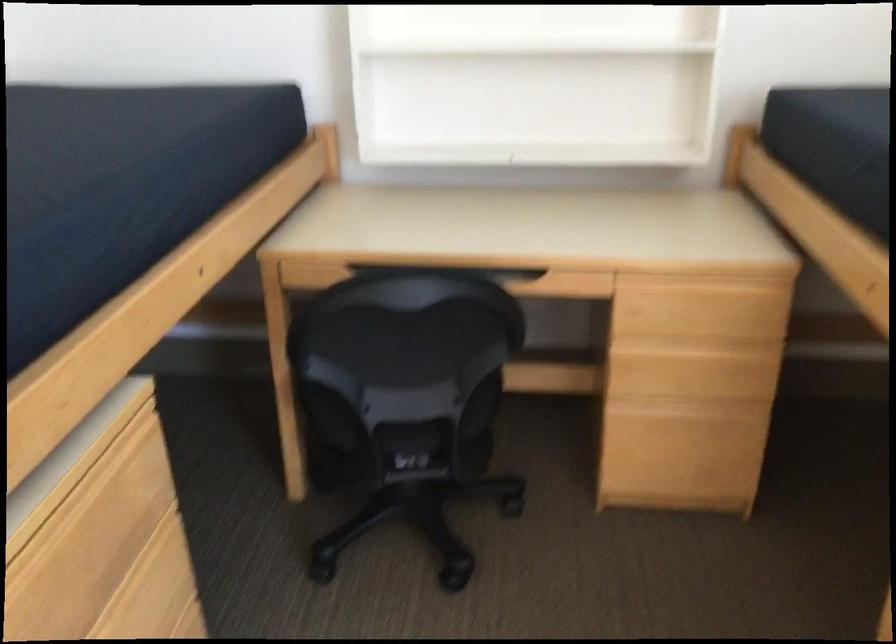
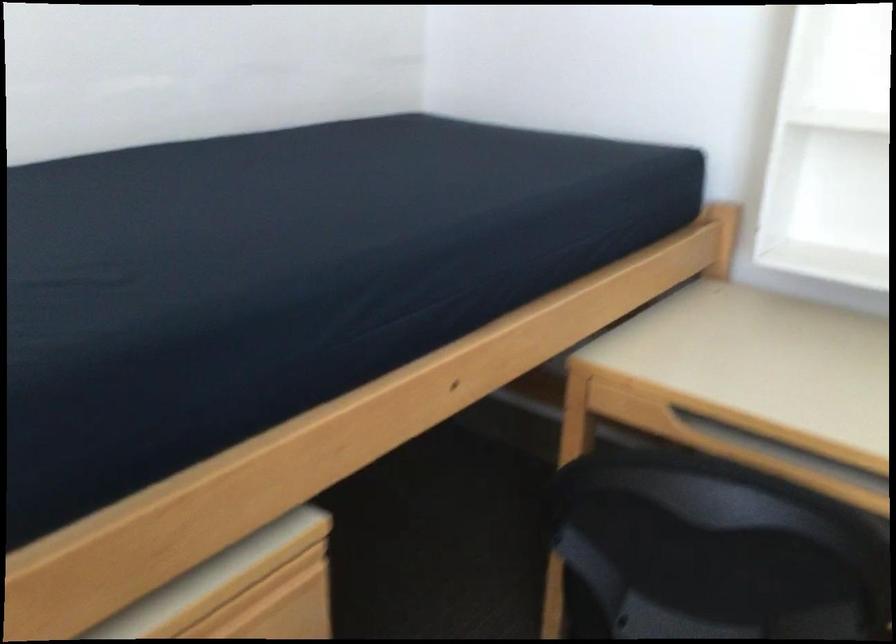
In the second image, find the point that corresponds to point 130,440 in the first image.

(277, 581)